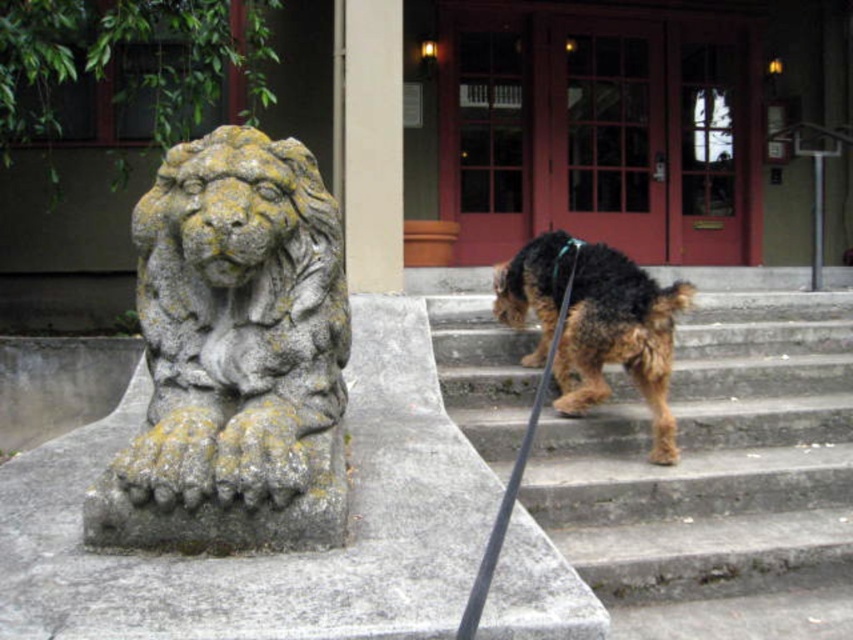
Question: Which point is closer to the camera?

Choices:
 (A) gray stone lion at left
 (B) gray concrete stairs at center

Answer: (A)

Question: Which object is the farthest from the brown shaggy dog at center?

Choices:
 (A) gray concrete stairs at center
 (B) gray stone lion at left
 (C) smooth concrete pillar at center

Answer: (B)

Question: Is gray concrete stairs at center behind smooth concrete pillar at center?

Choices:
 (A) no
 (B) yes

Answer: (A)

Question: Does gray stone lion at left appear on the left side of smooth concrete pillar at center?

Choices:
 (A) yes
 (B) no

Answer: (A)

Question: Is gray concrete stairs at center positioned before smooth concrete pillar at center?

Choices:
 (A) no
 (B) yes

Answer: (B)

Question: Which point is farther to the camera?

Choices:
 (A) (180, 147)
 (B) (709, 544)
 (C) (374, 280)
 (D) (593, 401)

Answer: (C)